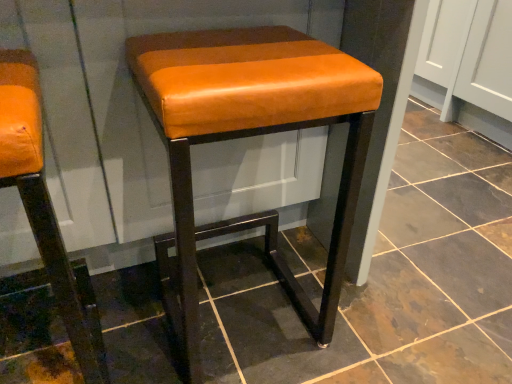
Question: Is orange leather stool at left, the second stool in the right-to-left sequence, far from matte orange leather stool at center, marked as the first stool in a right-to-left arrangement?

Choices:
 (A) no
 (B) yes

Answer: (A)

Question: From a real-world perspective, does orange leather stool at left, the second stool in the right-to-left sequence, stand above matte orange leather stool at center, marked as the first stool in a right-to-left arrangement?

Choices:
 (A) no
 (B) yes

Answer: (A)

Question: Considering the relative sizes of orange leather stool at left, the second stool in the right-to-left sequence, and matte orange leather stool at center, which appears as the 2th stool when viewed from the left, in the image provided, is orange leather stool at left, the second stool in the right-to-left sequence, shorter than matte orange leather stool at center, which appears as the 2th stool when viewed from the left,?

Choices:
 (A) no
 (B) yes

Answer: (A)

Question: Does orange leather stool at left, the first stool in the left-to-right sequence, lie behind matte orange leather stool at center, which appears as the 2th stool when viewed from the left?

Choices:
 (A) no
 (B) yes

Answer: (A)

Question: Could you tell me if orange leather stool at left, the second stool in the right-to-left sequence, is turned towards matte orange leather stool at center, which appears as the 2th stool when viewed from the left?

Choices:
 (A) yes
 (B) no

Answer: (B)

Question: Is orange leather stool at left, the second stool in the right-to-left sequence, next to matte orange leather stool at center, which appears as the 2th stool when viewed from the left, and touching it?

Choices:
 (A) yes
 (B) no

Answer: (B)

Question: Considering the relative positions of matte orange leather stool at center, which appears as the 2th stool when viewed from the left, and orange leather stool at left, the first stool in the left-to-right sequence, in the image provided, is matte orange leather stool at center, which appears as the 2th stool when viewed from the left, to the left of orange leather stool at left, the first stool in the left-to-right sequence, from the viewer's perspective?

Choices:
 (A) no
 (B) yes

Answer: (A)

Question: Is orange leather stool at left, the first stool in the left-to-right sequence, inside matte orange leather stool at center, marked as the first stool in a right-to-left arrangement?

Choices:
 (A) yes
 (B) no

Answer: (B)

Question: Is matte orange leather stool at center, which appears as the 2th stool when viewed from the left, beside orange leather stool at left, the second stool in the right-to-left sequence?

Choices:
 (A) no
 (B) yes

Answer: (A)

Question: Does matte orange leather stool at center, which appears as the 2th stool when viewed from the left, come behind orange leather stool at left, the second stool in the right-to-left sequence?

Choices:
 (A) yes
 (B) no

Answer: (A)

Question: Does matte orange leather stool at center, marked as the first stool in a right-to-left arrangement, have a larger size compared to orange leather stool at left, the second stool in the right-to-left sequence?

Choices:
 (A) no
 (B) yes

Answer: (B)

Question: Is matte orange leather stool at center, which appears as the 2th stool when viewed from the left, positioned with its back to orange leather stool at left, the first stool in the left-to-right sequence?

Choices:
 (A) yes
 (B) no

Answer: (B)

Question: Which is correct: matte orange leather stool at center, which appears as the 2th stool when viewed from the left, is inside orange leather stool at left, the first stool in the left-to-right sequence, or outside of it?

Choices:
 (A) outside
 (B) inside

Answer: (A)